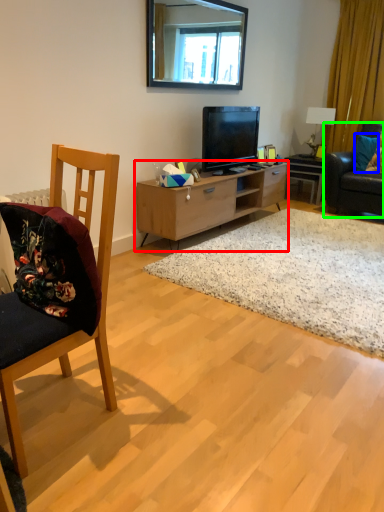
Question: Which is nearer to the cabinetry (highlighted by a red box)? pillow (highlighted by a blue box) or studio couch (highlighted by a green box).

Choices:
 (A) pillow
 (B) studio couch

Answer: (B)